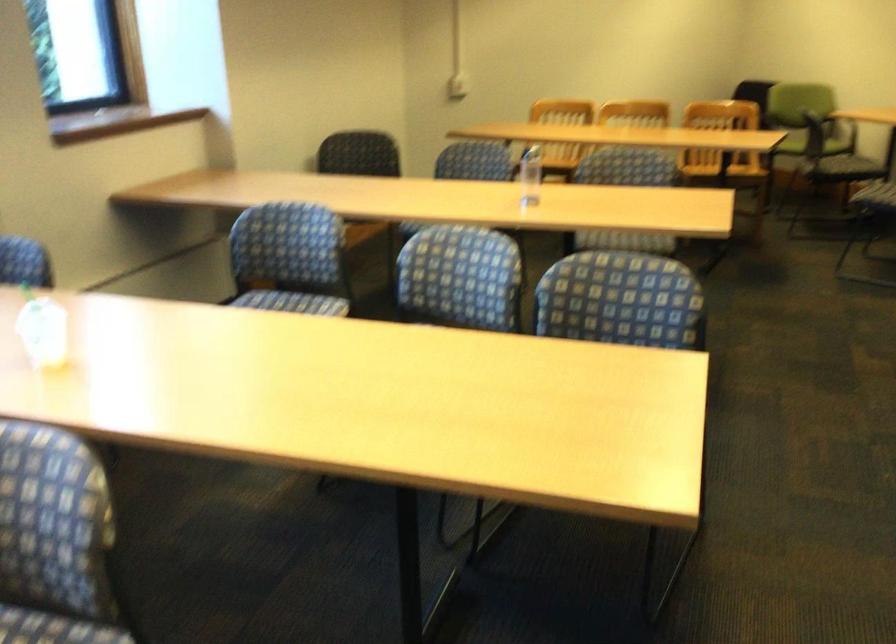
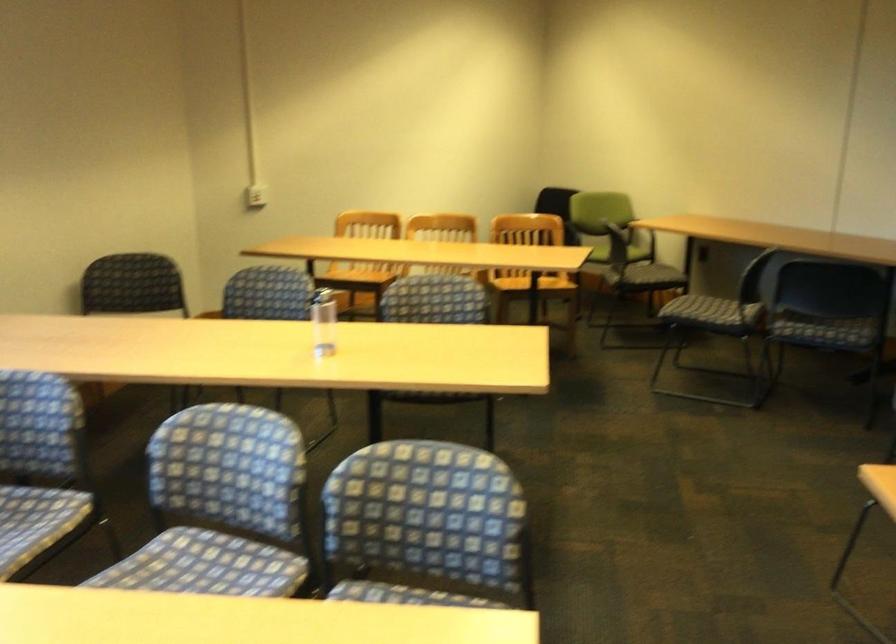
Locate, in the second image, the point that corresponds to point (786, 100) in the first image.

(589, 221)